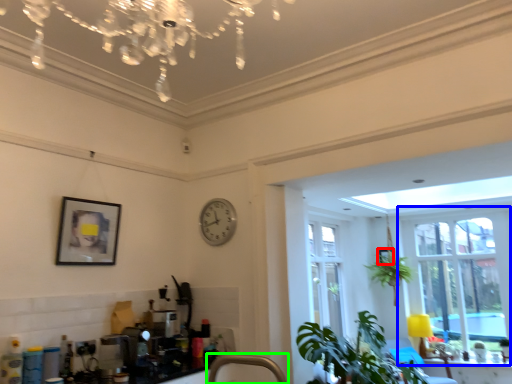
Question: Which object is the farthest from picture frame (highlighted by a red box)? Choose among these: window (highlighted by a blue box) or faucet (highlighted by a green box).

Choices:
 (A) window
 (B) faucet

Answer: (B)